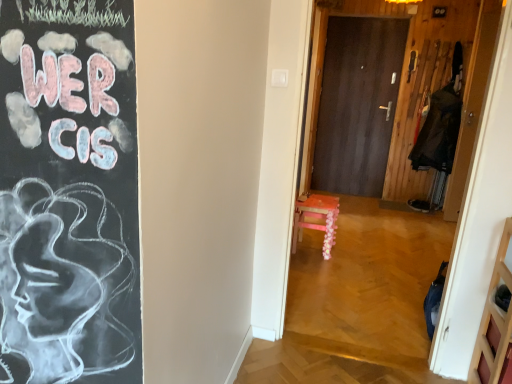
The width and height of the screenshot is (512, 384). Describe the element at coordinates (318, 219) in the screenshot. I see `wooden floral-patterned stool at center` at that location.

Locate an element on the screen. wooden door at right, placed as the second door when sorted from left to right is located at coordinates (473, 103).

Are dark wood door at center, positioned as the 1th door in back-to-front order, and dark blue fabric coat at right making contact?

They are not placed beside each other.

Does point (344, 105) come closer to viewer compared to point (451, 86)?

That is False.

Does dark wood door at center, positioned as the 1th door in back-to-front order, have a greater width compared to dark blue fabric coat at right?

No.

Looking at this image, is dark blue fabric coat at right inside dark wood door at center, the 2th door positioned from the front?

Actually, dark blue fabric coat at right is outside dark wood door at center, the 2th door positioned from the front.

Which object is closer to the camera taking this photo, dark wood door at center, marked as the first door in a left-to-right arrangement, or wooden floral-patterned stool at center?

wooden floral-patterned stool at center is more forward.

Is dark wood door at center, the 2th door positioned from the front, not inside wooden floral-patterned stool at center?

That's correct, dark wood door at center, the 2th door positioned from the front, is outside of wooden floral-patterned stool at center.

From the picture: From a real-world perspective, is dark wood door at center, the 2th door positioned from the front, under wooden floral-patterned stool at center?

Actually, dark wood door at center, the 2th door positioned from the front, is physically above wooden floral-patterned stool at center in the real world.

Is dark wood door at center, marked as the first door in a left-to-right arrangement, with wooden floral-patterned stool at center?

dark wood door at center, marked as the first door in a left-to-right arrangement, and wooden floral-patterned stool at center are clearly separated.

Is wooden door at right, which appears as the 2th door when viewed from the back, further to the viewer compared to dark blue fabric coat at right?

No, it is in front of dark blue fabric coat at right.

Is point (483, 98) farther from camera compared to point (409, 158)?

No.

Between wooden door at right, which is the 1th door from right to left, and dark blue fabric coat at right, which one has larger size?

Bigger between the two is dark blue fabric coat at right.

You are a GUI agent. You are given a task and a screenshot of the screen. Output one action in this format:
    pyautogui.click(x=<x>, y=<y>)
    Task: Click on the door in front of the dark blue fabric coat at right
    
    Given the screenshot: What is the action you would take?
    pyautogui.click(x=473, y=103)

Would you say dark blue fabric coat at right is inside or outside wooden door at right, placed as the second door when sorted from left to right?

dark blue fabric coat at right is not inside wooden door at right, placed as the second door when sorted from left to right, it's outside.

Could you tell me if dark blue fabric coat at right is turned towards wooden door at right, which is the 1th door from right to left?

No.

Which of these two, wooden floral-patterned stool at center or wooden door at right, which is the 1th door from right to left, stands shorter?

Standing shorter between the two is wooden floral-patterned stool at center.

Is wooden door at right, placed as the second door when sorted from left to right, completely or partially inside wooden floral-patterned stool at center?

Definitely not — wooden door at right, placed as the second door when sorted from left to right, is not inside wooden floral-patterned stool at center.

Does wooden floral-patterned stool at center have a larger size compared to wooden door at right, which is counted as the first door, starting from the front?

Correct, wooden floral-patterned stool at center is larger in size than wooden door at right, which is counted as the first door, starting from the front.

Can you confirm if wooden floral-patterned stool at center is positioned to the left of wooden door at right, which appears as the 2th door when viewed from the back?

Correct, you'll find wooden floral-patterned stool at center to the left of wooden door at right, which appears as the 2th door when viewed from the back.

This screenshot has height=384, width=512. Find the location of `the 1st door positioned above the dark blue fabric coat at right (from a real-world perspective)`. the 1st door positioned above the dark blue fabric coat at right (from a real-world perspective) is located at coordinates (357, 104).

Can you confirm if dark blue fabric coat at right is smaller than dark wood door at center, positioned as the 1th door in back-to-front order?

Actually, dark blue fabric coat at right might be larger than dark wood door at center, positioned as the 1th door in back-to-front order.

Which of these two, dark blue fabric coat at right or dark wood door at center, the 2th door positioned from the front, stands taller?

With more height is dark wood door at center, the 2th door positioned from the front.

Is point (413, 155) positioned in front of point (340, 33)?

Yes, it is.

Could you tell me if wooden door at right, which is the 1th door from right to left, is turned towards wooden floral-patterned stool at center?

No, wooden door at right, which is the 1th door from right to left, is not turned towards wooden floral-patterned stool at center.

Where is `furniture in front of the wooden door at right, placed as the second door when sorted from left to right`? furniture in front of the wooden door at right, placed as the second door when sorted from left to right is located at coordinates (318, 219).

Considering the sizes of objects wooden door at right, placed as the second door when sorted from left to right, and wooden floral-patterned stool at center in the image provided, who is wider, wooden door at right, placed as the second door when sorted from left to right, or wooden floral-patterned stool at center?

Wider between the two is wooden floral-patterned stool at center.

Which is behind, wooden door at right, placed as the second door when sorted from left to right, or wooden floral-patterned stool at center?

wooden door at right, placed as the second door when sorted from left to right, is further from the camera.

Locate an element on the screen. This screenshot has width=512, height=384. door located behind the dark blue fabric coat at right is located at coordinates (357, 104).

At what (x,y) coordinates should I click in order to perform the action: click on furniture in front of the dark wood door at center, positioned as the second door in right-to-left order. Please return your answer as a coordinate pair (x, y). The width and height of the screenshot is (512, 384). Looking at the image, I should click on (318, 219).

From the image, which object appears to be farther from wooden door at right, which appears as the 2th door when viewed from the back, dark blue fabric coat at right or wooden floral-patterned stool at center?

Among the two, wooden floral-patterned stool at center is located further to wooden door at right, which appears as the 2th door when viewed from the back.

Looking at the image, which one is located closer to wooden door at right, which is counted as the first door, starting from the front, dark wood door at center, marked as the first door in a left-to-right arrangement, or dark blue fabric coat at right?

The object closer to wooden door at right, which is counted as the first door, starting from the front, is dark blue fabric coat at right.

Which object lies nearer to the anchor point wooden door at right, which is counted as the first door, starting from the front, dark blue fabric coat at right or dark wood door at center, the 2th door positioned from the front?

The object closer to wooden door at right, which is counted as the first door, starting from the front, is dark blue fabric coat at right.

Estimate the real-world distances between objects in this image. Which object is further from dark wood door at center, the 2th door positioned from the front, dark blue fabric coat at right or wooden floral-patterned stool at center?

wooden floral-patterned stool at center lies further to dark wood door at center, the 2th door positioned from the front, than the other object.

Considering their positions, is wooden floral-patterned stool at center positioned closer to wooden door at right, which is the 1th door from right to left, than dark wood door at center, the 2th door positioned from the front?

dark wood door at center, the 2th door positioned from the front, is closer to wooden door at right, which is the 1th door from right to left.

Considering their positions, is wooden door at right, which appears as the 2th door when viewed from the back, positioned further to wooden floral-patterned stool at center than dark wood door at center, positioned as the 1th door in back-to-front order?

wooden door at right, which appears as the 2th door when viewed from the back, is further to wooden floral-patterned stool at center.

Looking at the image, which one is located closer to dark blue fabric coat at right, dark wood door at center, positioned as the 1th door in back-to-front order, or wooden floral-patterned stool at center?

dark wood door at center, positioned as the 1th door in back-to-front order, is positioned closer to the anchor dark blue fabric coat at right.

Based on their spatial positions, is wooden floral-patterned stool at center or dark blue fabric coat at right closer to wooden door at right, placed as the second door when sorted from left to right?

dark blue fabric coat at right lies closer to wooden door at right, placed as the second door when sorted from left to right, than the other object.

Image resolution: width=512 pixels, height=384 pixels. Identify the location of door between wooden floral-patterned stool at center and dark blue fabric coat at right in the horizontal direction. (357, 104).

The height and width of the screenshot is (384, 512). Identify the location of door located between wooden floral-patterned stool at center and wooden door at right, which is the 1th door from right to left, in the left-right direction. (357, 104).

Locate an element on the screen. The image size is (512, 384). garment between wooden floral-patterned stool at center and wooden door at right, which appears as the 2th door when viewed from the back, from left to right is located at coordinates (438, 132).

Where is `garment between dark wood door at center, positioned as the second door in right-to-left order, and wooden door at right, which appears as the 2th door when viewed from the back, in the horizontal direction`? The height and width of the screenshot is (384, 512). garment between dark wood door at center, positioned as the second door in right-to-left order, and wooden door at right, which appears as the 2th door when viewed from the back, in the horizontal direction is located at coordinates (438, 132).